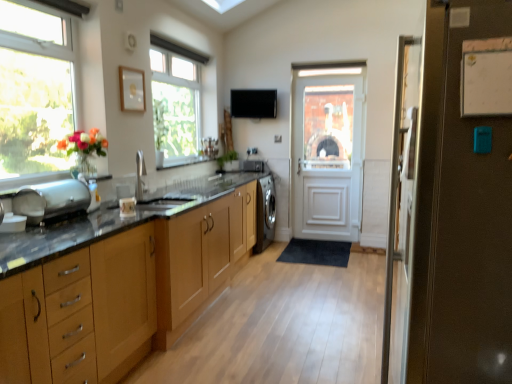
Question: Can you confirm if black matte exhaust hood at upper center is taller than wooden cabinets at center, which is counted as the 2th cabinetry, starting from the left?

Choices:
 (A) no
 (B) yes

Answer: (A)

Question: Does black matte exhaust hood at upper center have a lesser height compared to wooden cabinets at center, placed as the first cabinetry when sorted from right to left?

Choices:
 (A) yes
 (B) no

Answer: (A)

Question: Does black matte exhaust hood at upper center touch wooden cabinets at center, which appears as the 2th cabinetry when viewed from the front?

Choices:
 (A) yes
 (B) no

Answer: (B)

Question: Is the position of black matte exhaust hood at upper center less distant than that of wooden cabinets at center, which is counted as the 2th cabinetry, starting from the left?

Choices:
 (A) yes
 (B) no

Answer: (B)

Question: From the image's perspective, is black matte exhaust hood at upper center located above wooden cabinets at center, which is counted as the 2th cabinetry, starting from the left?

Choices:
 (A) yes
 (B) no

Answer: (A)

Question: In the image, is brown matte refrigerator at right, which is the 2th door in back-to-front order, positioned in front of or behind satin black washing machine at center, which is counted as the 1th appliance, starting from the top?

Choices:
 (A) front
 (B) behind

Answer: (A)

Question: Is brown matte refrigerator at right, the 1th door when ordered from front to back, situated inside satin black washing machine at center, marked as the 2th appliance in a left-to-right arrangement, or outside?

Choices:
 (A) inside
 (B) outside

Answer: (B)

Question: From the image's perspective, is brown matte refrigerator at right, the 1th door when ordered from front to back, above or below satin black washing machine at center, the second appliance positioned from the front?

Choices:
 (A) below
 (B) above

Answer: (A)

Question: Based on their sizes in the image, would you say brown matte refrigerator at right, which is the 2th door in back-to-front order, is bigger or smaller than satin black washing machine at center, the 2th appliance in the bottom-to-top sequence?

Choices:
 (A) big
 (B) small

Answer: (A)

Question: Relative to white wooden door at center, the first door in the back-to-front sequence, is white paper at upper right in front or behind?

Choices:
 (A) front
 (B) behind

Answer: (A)

Question: From a real-world perspective, relative to white wooden door at center, which is counted as the 2th door, starting from the front, is white paper at upper right vertically above or below?

Choices:
 (A) below
 (B) above

Answer: (B)

Question: Is white paper at upper right taller or shorter than white wooden door at center, the first door in the back-to-front sequence?

Choices:
 (A) short
 (B) tall

Answer: (A)

Question: From the image's perspective, is white paper at upper right above or below white wooden door at center, the first door in the back-to-front sequence?

Choices:
 (A) below
 (B) above

Answer: (A)

Question: Looking at their shapes, would you say wooden cabinet at left, the 2th cabinetry positioned from the right, is wider or thinner than satin black washing machine at center, the 2th appliance in the bottom-to-top sequence?

Choices:
 (A) wide
 (B) thin

Answer: (A)

Question: Is wooden cabinet at left, which ranks as the 1th cabinetry in front-to-back order, bigger or smaller than satin black washing machine at center, marked as the 2th appliance in a left-to-right arrangement?

Choices:
 (A) small
 (B) big

Answer: (B)